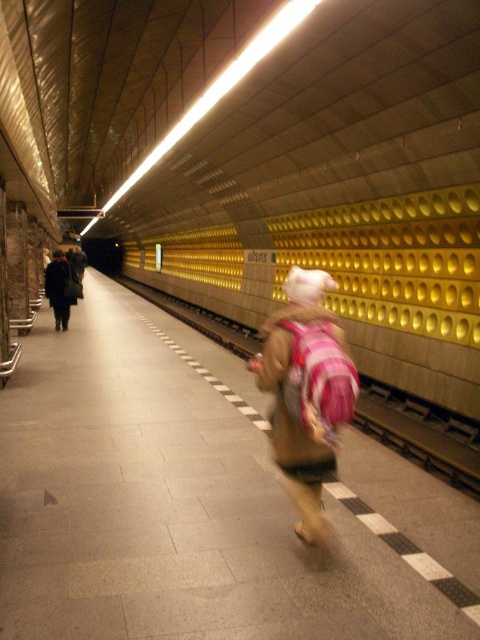
Can you confirm if brown fuzzy coat at center is shorter than dark wool coat at left?

In fact, brown fuzzy coat at center may be taller than dark wool coat at left.

This screenshot has width=480, height=640. I want to click on brown fuzzy coat at center, so click(305, 392).

This screenshot has width=480, height=640. What are the coordinates of `brown fuzzy coat at center` in the screenshot? It's located at (305, 392).